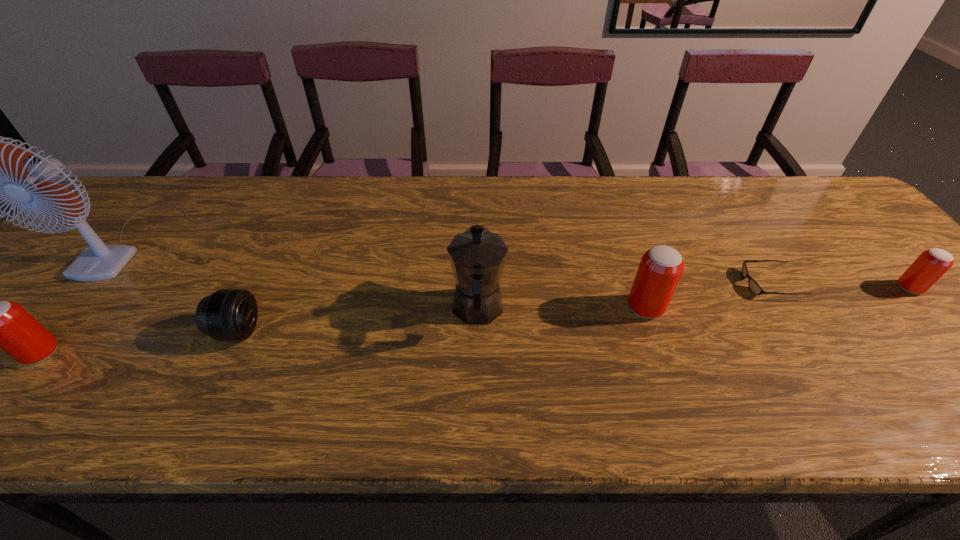
You are a GUI agent. You are given a task and a screenshot of the screen. Output one action in this format:
    pyautogui.click(x=<x>, y=<y>)
    Task: Click on the object that is at the near left corner
    The height and width of the screenshot is (540, 960).
    Given the screenshot: What is the action you would take?
    pyautogui.click(x=3, y=324)

Where is `free location at the far edge`? free location at the far edge is located at coordinates (522, 205).

Identify the location of vacant position at the near edge of the desktop. The width and height of the screenshot is (960, 540). (71, 360).

At what (x,y) coordinates should I click in order to perform the action: click on free space at the left edge. Please return your answer as a coordinate pair (x, y). The image size is (960, 540). Looking at the image, I should click on (78, 308).

In the image, there is a desktop. Find the location of `vacant region at the right edge`. vacant region at the right edge is located at coordinates (956, 329).

In the image, there is a desktop. Find the location of `vacant space at the far right corner`. vacant space at the far right corner is located at coordinates (827, 223).

At what (x,y) coordinates should I click in order to perform the action: click on vacant area between the coffeepot and the third tallest object. Please return your answer as a coordinate pair (x, y). This screenshot has width=960, height=540. Looking at the image, I should click on (562, 309).

This screenshot has height=540, width=960. What are the coordinates of `vacant space that's between the fifth object from left to right and the rightmost object` in the screenshot? It's located at (778, 298).

Where is `vacant space that's between the shortest beer can and the fifth object from right to left`? This screenshot has width=960, height=540. vacant space that's between the shortest beer can and the fifth object from right to left is located at coordinates (574, 309).

Identify the location of vacant space in between the second object from right to left and the tallest beer can. [708, 295].